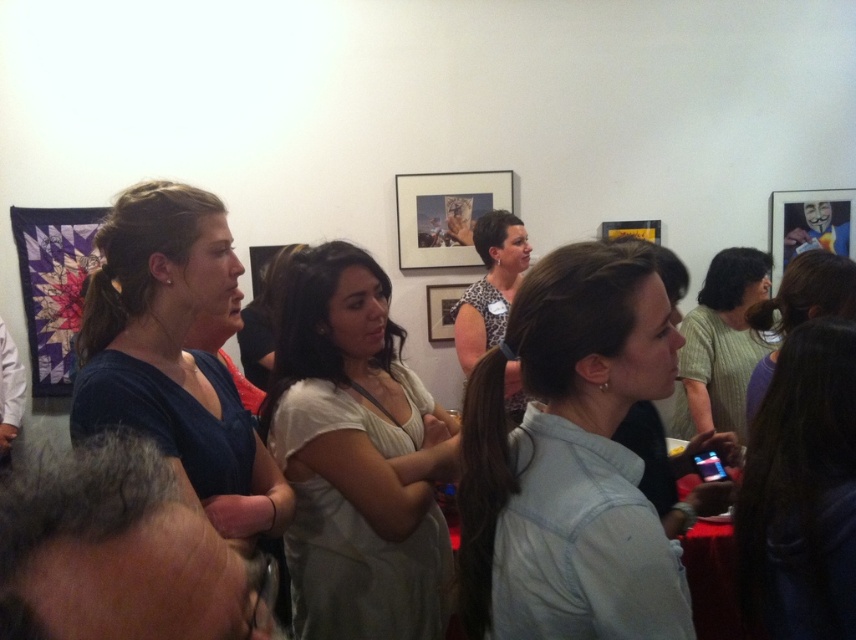
You are at an event and want to take a photo of the blue matte shirt at center and the leopard print blouse at center. Which one is lower in the image?

The blue matte shirt at center is positioned under the leopard print blouse at center, so it is lower in the image.

You are at point (477,300) and want to move to the exit located at point (755,465). Is the exit directly behind you or in front of you?

The exit at point (755,465) is in front of you because point (755,465) is in front of point (477,300).